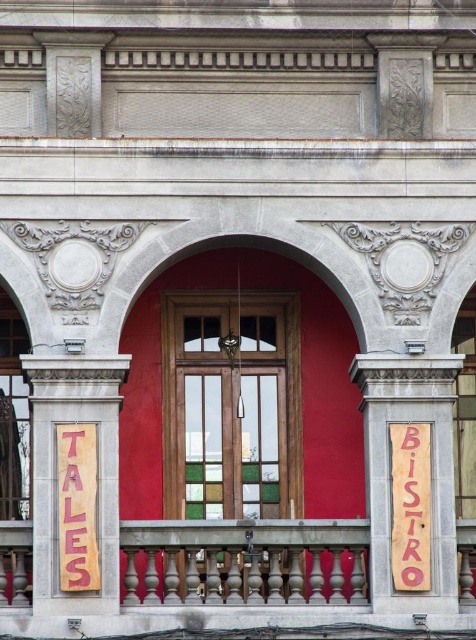
Question: Can you confirm if wooden sign at left is bigger than smooth gray balustrade at center?

Choices:
 (A) no
 (B) yes

Answer: (B)

Question: Estimate the real-world distances between objects in this image. Which object is closer to the wooden sign at right?

Choices:
 (A) wooden sign at left
 (B) pink cardboard sign at center
 (C) wooden sign at center

Answer: (C)

Question: Does wooden sign at left appear on the left side of wooden sign at center?

Choices:
 (A) yes
 (B) no

Answer: (A)

Question: Which of the following is the farthest from the observer?

Choices:
 (A) pink cardboard sign at center
 (B) wooden sign at center

Answer: (B)

Question: Is smooth gray balustrade at center positioned in front of wooden sign at right?

Choices:
 (A) no
 (B) yes

Answer: (B)

Question: Estimate the real-world distances between objects in this image. Which object is closer to the wooden sign at right?

Choices:
 (A) wooden sign at left
 (B) smooth gray balustrade at center
 (C) wooden sign at center
 (D) pink cardboard sign at center

Answer: (C)